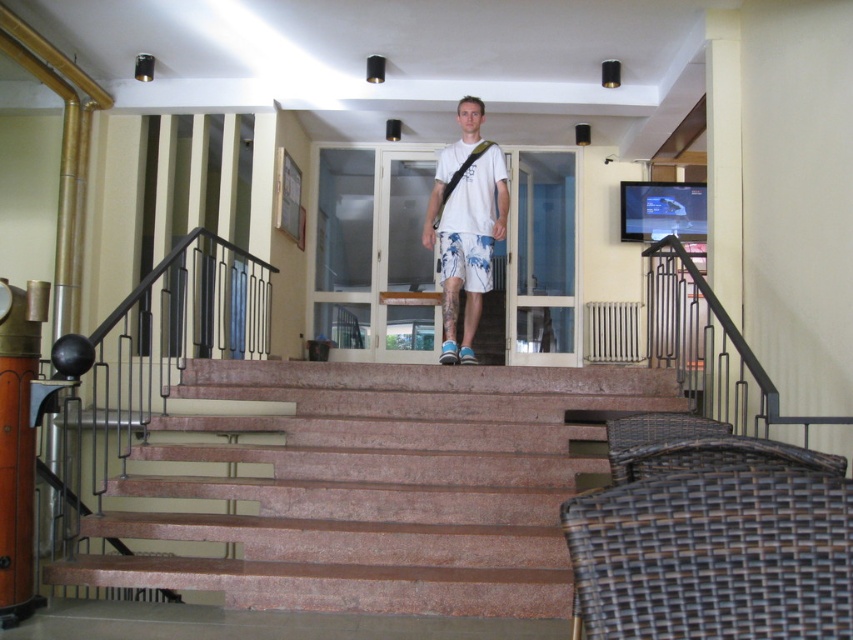
You are standing at the bottom of the staircase in the image and want to walk to the landing area. There are two points marked on the staircase. Which point is closer to you, the point at coordinate (486, 150) or the point at (473, 253)?

The point at coordinate (486, 150) is closer to you because it is further to the viewer than the point at (473, 253).

You are standing at the bottom of the marble stairs at center and want to place a small potted plant exactly at the midpoint between the stairs and the decorative cylindrical object on the left. Can you determine the coordinates where you should place the plant?

The marble stairs at center is located at point [363,484]. To find the midpoint between the stairs and the decorative cylindrical object on the left, you would need the coordinates of both objects. Since only the stairs coordinates are provided, the exact midpoint cannot be calculated without the cylindrical object coordinates.